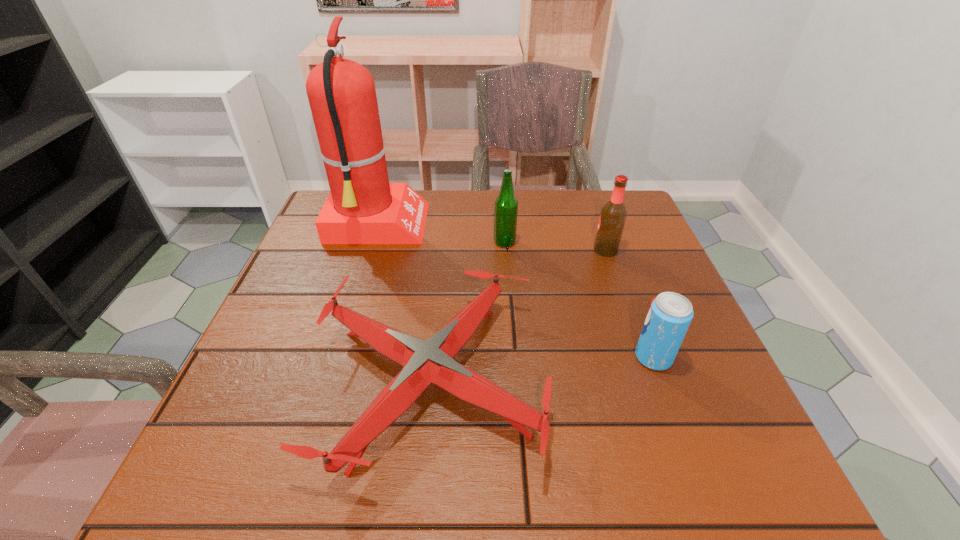
Where is `the tallest object`? This screenshot has height=540, width=960. the tallest object is located at coordinates (363, 207).

This screenshot has width=960, height=540. In order to click on the right beer bottle in this screenshot , I will do `click(613, 215)`.

The image size is (960, 540). I want to click on the left beer bottle, so click(506, 205).

At what (x,y) coordinates should I click in order to perform the action: click on the second shortest object. Please return your answer as a coordinate pair (x, y). This screenshot has width=960, height=540. Looking at the image, I should click on (670, 314).

The width and height of the screenshot is (960, 540). Find the location of `drone`. drone is located at coordinates (424, 362).

Find the location of a particular element. The width and height of the screenshot is (960, 540). vacant region located on the front-facing side of the tallest object is located at coordinates (570, 225).

Where is `vacant space located 0.310m on the front of the right beer bottle`? This screenshot has width=960, height=540. vacant space located 0.310m on the front of the right beer bottle is located at coordinates (643, 357).

The height and width of the screenshot is (540, 960). What are the coordinates of `vacant space located 0.130m on the label of the left beer bottle` in the screenshot? It's located at (443, 242).

In order to click on free spot located 0.380m on the label of the left beer bottle in this screenshot , I will do `click(346, 242)`.

The height and width of the screenshot is (540, 960). What are the coordinates of `vacant space located on the label of the left beer bottle` in the screenshot? It's located at (393, 242).